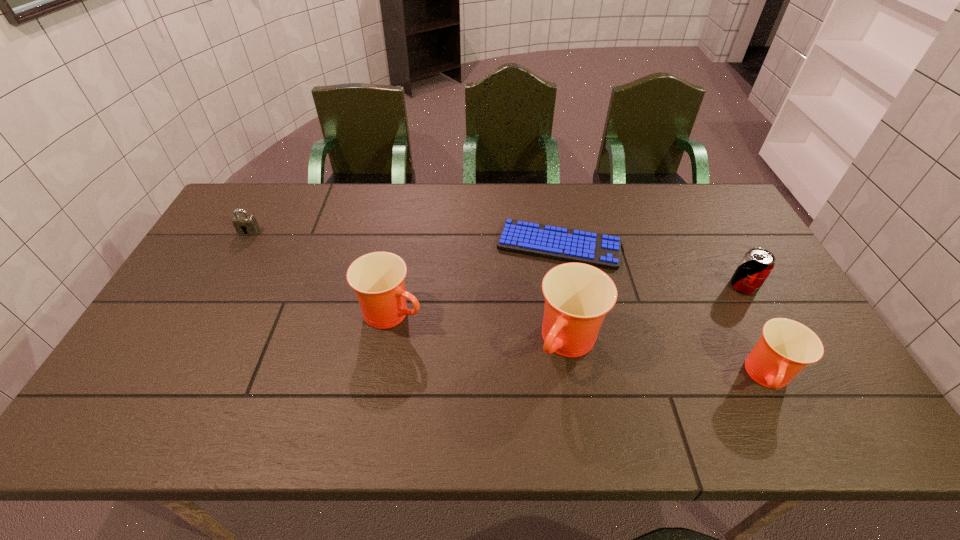
Locate an element on the screen. Image resolution: width=960 pixels, height=540 pixels. vacant region located on the back of the rightmost cup is located at coordinates (734, 311).

You are a GUI agent. You are given a task and a screenshot of the screen. Output one action in this format:
    pyautogui.click(x=<x>, y=<y>)
    Task: Click on the blank area located on the left of the soda can
    Image resolution: width=960 pixels, height=540 pixels.
    Given the screenshot: What is the action you would take?
    pyautogui.click(x=608, y=286)

Locate an element on the screen. Image resolution: width=960 pixels, height=540 pixels. vacant region located on the right of the shortest object is located at coordinates point(637,245).

Find the location of a particular element. free space located at the front of the second shortest object near the keyhole is located at coordinates (210, 302).

What are the coordinates of `object situated at the far edge` in the screenshot? It's located at (599, 250).

The image size is (960, 540). I want to click on object that is at the left edge, so [x=245, y=225].

The width and height of the screenshot is (960, 540). In order to click on cup located at the right edge in this screenshot , I will do `click(786, 347)`.

Image resolution: width=960 pixels, height=540 pixels. I want to click on soda can positioned at the right edge, so click(x=756, y=265).

I want to click on object that is at the near right corner, so click(786, 347).

Identify the location of free region at the far edge. This screenshot has height=540, width=960. (388, 201).